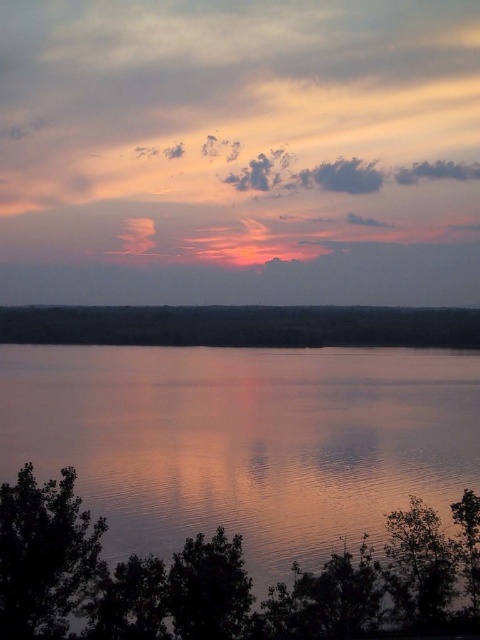
Is smooth reflective water at center positioned before smooth dark water at center?

Yes.

Who is taller, smooth reflective water at center or smooth dark water at center?

With more height is smooth reflective water at center.

Between point (213, 442) and point (445, 339), which one is positioned behind?

Positioned behind is point (445, 339).

I want to click on smooth reflective water at center, so click(244, 440).